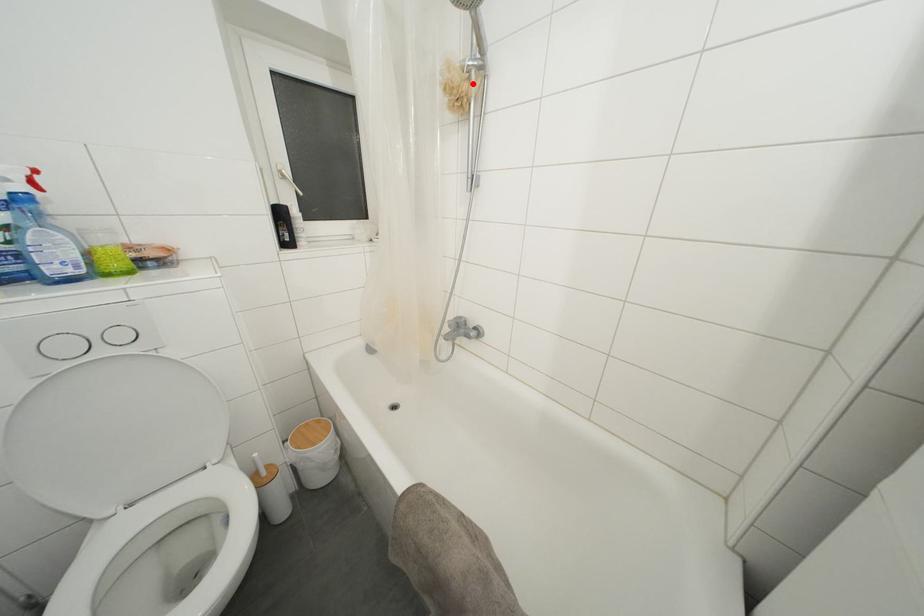
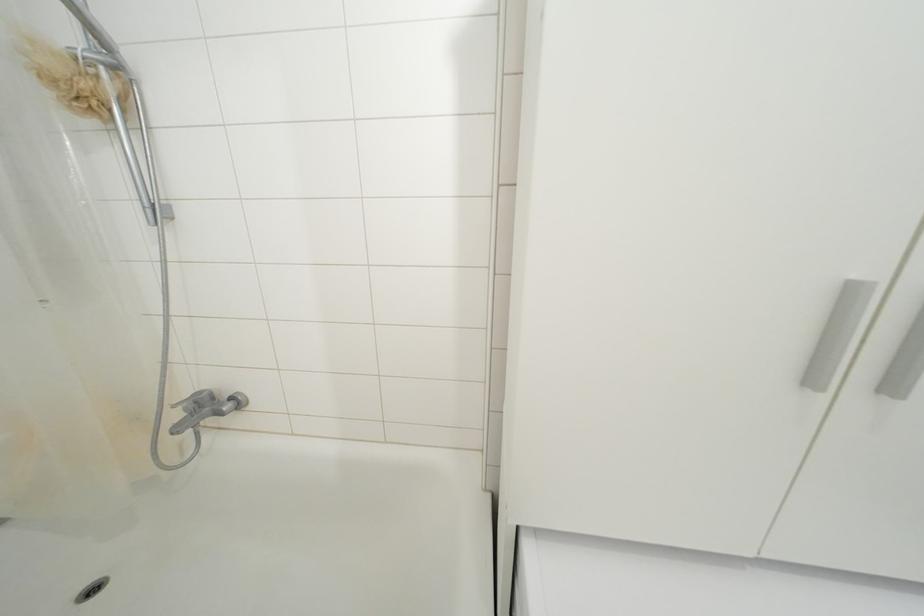
Question: I am providing you with two images of the same scene from different viewpoints. Image1 has a red point marked. In image2, the corresponding 3D location appears at what relative position? Reply with the corresponding letter.

Choices:
 (A) Closer
 (B) Farther

Answer: (B)